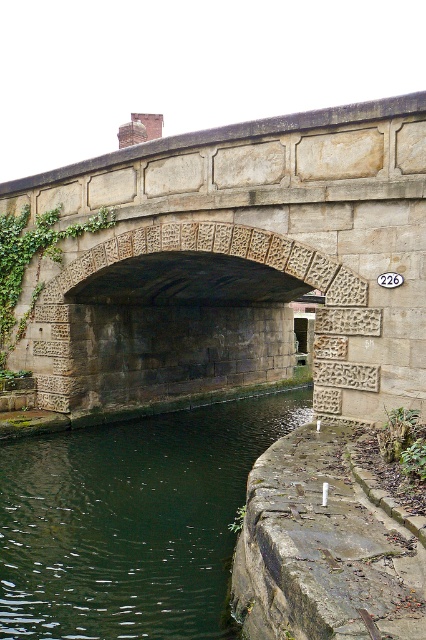
Between stone textured bridge at center and green ivy at center, which one has more height?

stone textured bridge at center

In order to click on stone textured bridge at center in this screenshot , I will do `click(233, 266)`.

You are a GUI agent. You are given a task and a screenshot of the screen. Output one action in this format:
    pyautogui.click(x=<x>, y=<y>)
    Task: Click on the stone textured bridge at center
    This screenshot has height=640, width=426.
    Given the screenshot: What is the action you would take?
    pyautogui.click(x=233, y=266)

Find the location of a particular element. The width and height of the screenshot is (426, 640). stone textured bridge at center is located at coordinates (233, 266).

Between stone textured bridge at center and green stone water at lower left, which one has more height?

stone textured bridge at center

The height and width of the screenshot is (640, 426). What are the coordinates of `stone textured bridge at center` in the screenshot? It's located at (233, 266).

Between green stone water at lower left and green ivy at center, which one appears on the left side from the viewer's perspective?

Positioned to the left is green ivy at center.

Does point (6, 611) come in front of point (26, 259)?

That is True.

This screenshot has height=640, width=426. In order to click on green stone water at lower left in this screenshot , I will do 132,522.